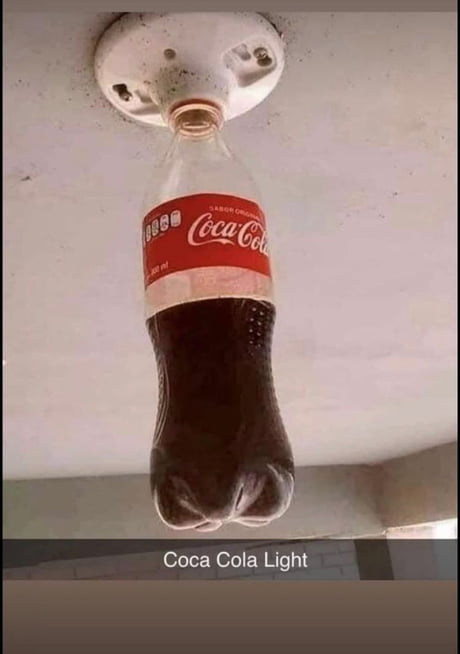
Locate an element on the screen. This screenshot has height=654, width=460. light fixture is located at coordinates (197, 48).